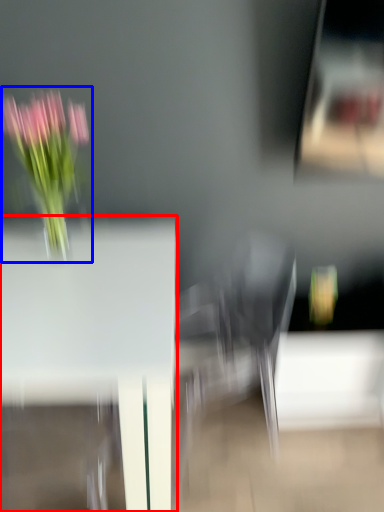
Question: Which object appears farthest to the camera in this image, table (highlighted by a red box) or floral arrangement (highlighted by a blue box)?

Choices:
 (A) table
 (B) floral arrangement

Answer: (B)